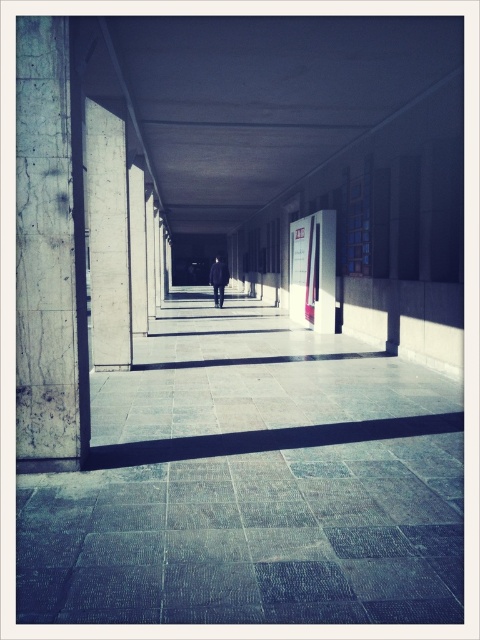
Can you confirm if marble pillar at left is bigger than dark wool coat at center?

No.

Which is more to the left, marble pillar at left or dark wool coat at center?

From the viewer's perspective, marble pillar at left appears more on the left side.

What do you see at coordinates (49, 252) in the screenshot? This screenshot has width=480, height=640. I see `marble pillar at left` at bounding box center [49, 252].

You are a GUI agent. You are given a task and a screenshot of the screen. Output one action in this format:
    pyautogui.click(x=<x>, y=<y>)
    Task: Click on the marble pillar at left
    This screenshot has width=480, height=640.
    Given the screenshot: What is the action you would take?
    pyautogui.click(x=49, y=252)